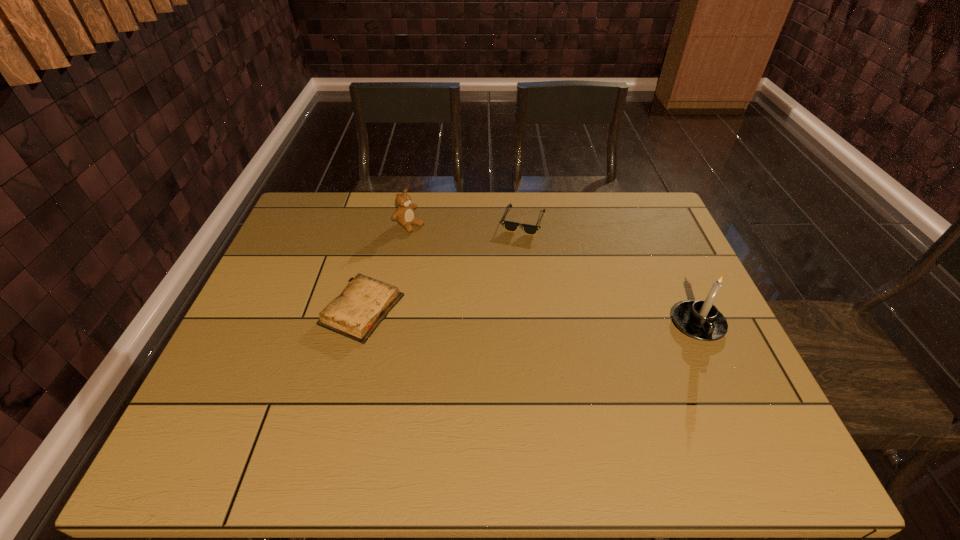
At what (x,y) coordinates should I click in order to perform the action: click on diary. Please return your answer as a coordinate pair (x, y). The image size is (960, 540). Looking at the image, I should click on (365, 302).

Where is `the rightmost object`? the rightmost object is located at coordinates (701, 320).

The image size is (960, 540). Find the location of `the tallest object`. the tallest object is located at coordinates (701, 320).

Locate an element on the screen. The width and height of the screenshot is (960, 540). sunglasses is located at coordinates (508, 225).

The image size is (960, 540). Identify the location of teddy bear. (404, 215).

Where is `vacant point located on the left of the diary`? The width and height of the screenshot is (960, 540). vacant point located on the left of the diary is located at coordinates (292, 309).

You are a GUI agent. You are given a task and a screenshot of the screen. Output one action in this format:
    pyautogui.click(x=<x>, y=<y>)
    Task: Click on the free space located 0.120m with a handle on the side of the tallest object
    This screenshot has width=960, height=540.
    Given the screenshot: What is the action you would take?
    pyautogui.click(x=728, y=388)

The width and height of the screenshot is (960, 540). What are the coordinates of `vacant space positioned 0.230m on the lenses of the sunglasses` in the screenshot? It's located at (554, 288).

Locate an element on the screen. The height and width of the screenshot is (540, 960). free spot located on the lenses of the sunglasses is located at coordinates (540, 260).

The width and height of the screenshot is (960, 540). What are the coordinates of `free space located 0.280m on the lenses of the sunglasses` in the screenshot? It's located at (560, 301).